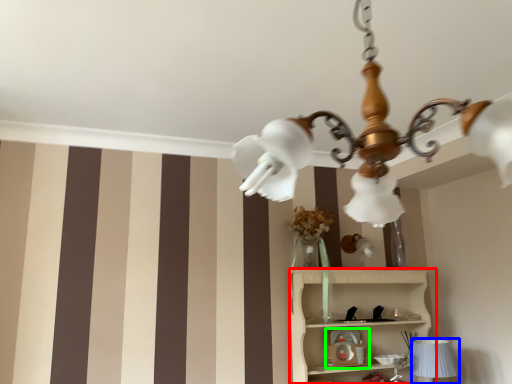
Question: Considering the real-world distances, which object is closest to shelf (highlighted by a red box)? table lamp (highlighted by a blue box) or toy (highlighted by a green box).

Choices:
 (A) table lamp
 (B) toy

Answer: (B)